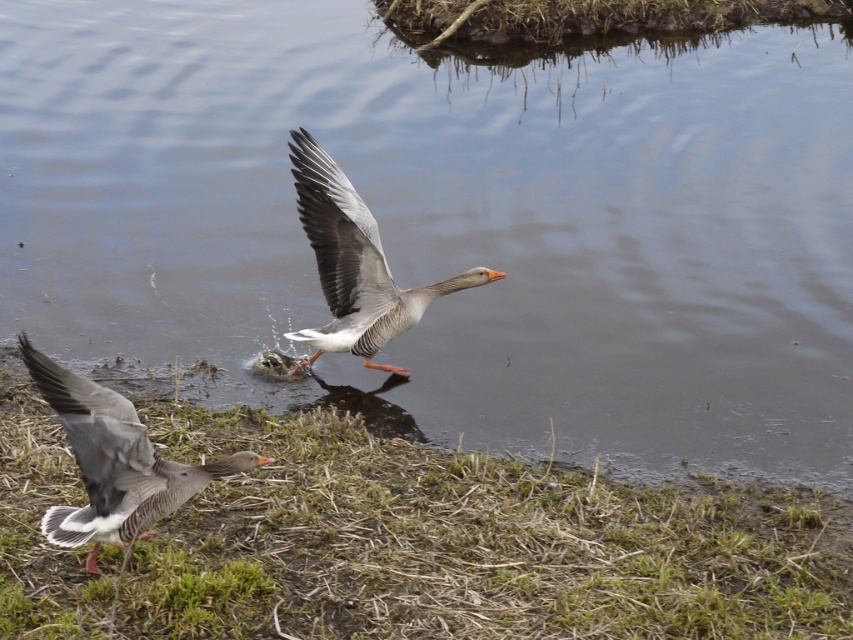
Is green dry grass at lower left positioned at the back of gray matte goose at center?

No, green dry grass at lower left is in front of gray matte goose at center.

Which is above, green dry grass at lower left or gray matte goose at center?

gray matte goose at center is higher up.

Locate an element on the screen. This screenshot has height=640, width=853. green dry grass at lower left is located at coordinates (467, 545).

Find the location of a particular element. green dry grass at lower left is located at coordinates (467, 545).

Is point (350, 413) more distant than point (144, 492)?

Yes, it is.

Between green dry grass at lower left and gray matte duck at lower left, which one has less height?

Standing shorter between the two is gray matte duck at lower left.

Who is more forward, (73, 481) or (131, 420)?

Point (131, 420)

Find the location of a particular element. The width and height of the screenshot is (853, 640). green dry grass at lower left is located at coordinates (467, 545).

Is gray matte duck at lower left wider than gray matte goose at center?

Incorrect, gray matte duck at lower left's width does not surpass gray matte goose at center's.

Where is `gray matte duck at lower left`? The image size is (853, 640). gray matte duck at lower left is located at coordinates [x=114, y=461].